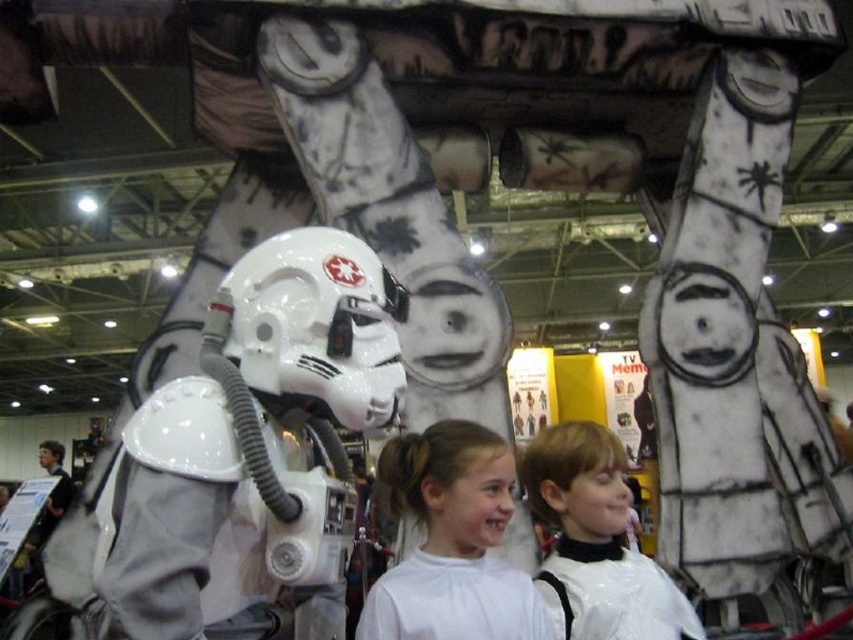
Question: Is white matte shirt at center below white glossy hair at center?

Choices:
 (A) no
 (B) yes

Answer: (A)

Question: Is white matte shirt at center wider than white glossy hair at center?

Choices:
 (A) yes
 (B) no

Answer: (B)

Question: Is white matte shirt at center smaller than white glossy hair at center?

Choices:
 (A) yes
 (B) no

Answer: (A)